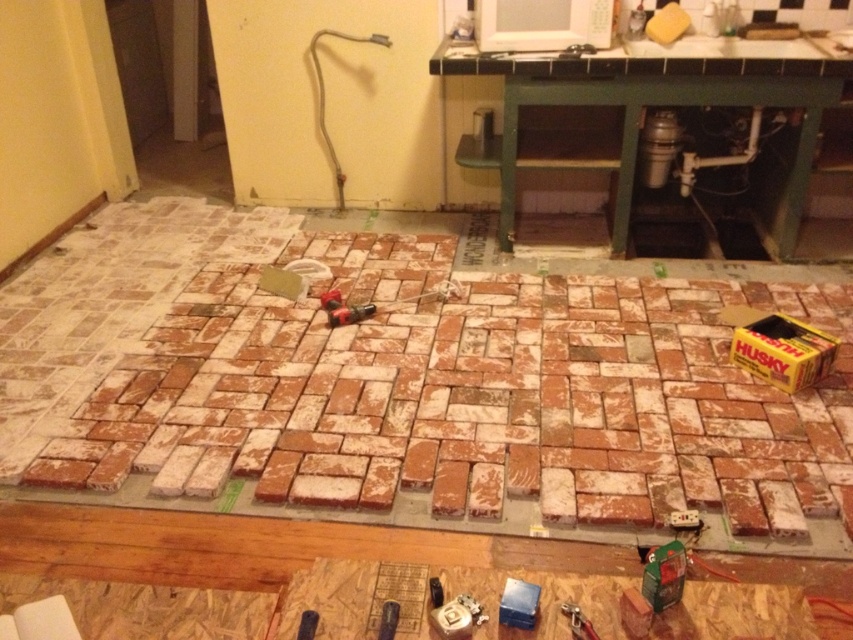
You are a contractor working on the brick or tile installation project. You need to move from the point at coordinates (392, 621) to the workbench in the foreground. Can you reach it without stepping on the partially covered floor with concrete or mortar? The workbench is located in the foreground area, and the concrete or mortar is on the floor behind it.

The distance between the point at coordinates (392, 621) and the workbench is 1.55 meters. Since the workbench is in the foreground and the concrete or mortar is behind it, you can safely reach the workbench without stepping on the concrete or mortar by moving around the work area.

You are standing at the origin point in the workspace. You need to move from point (93, 403) to point (328, 298). Which direction should you move?

You should move backward since point (93, 403) is in front of point (328, 298).

You are a contractor working on a tile installation project and need to place a new tool on the wooden workbench. The terracotta clay bricks at center and the metallic red drill at center are already on the bench. Where should you place the new tool so it doesn not interfere with the existing items?

Place the new tool to the left of the metallic red drill at center since the terracotta clay bricks at center are already on its right side, leaving space on the left.